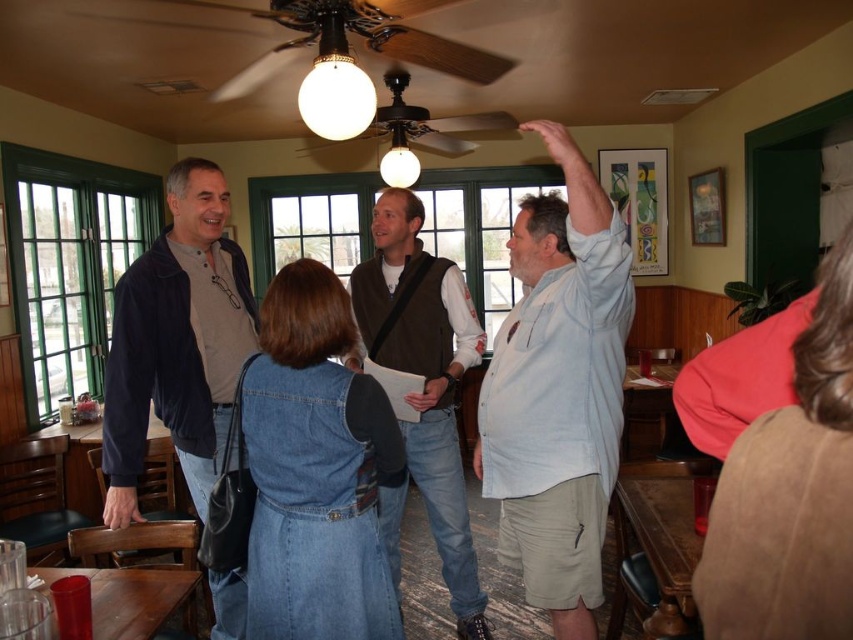
You are a delivery person who needs to place a small package between the light blue cotton shirt at upper right and the brown suede vest at center. Can the package, which is 20 inches long, fit in the space between them?

The distance between the light blue cotton shirt at upper right and the brown suede vest at center is 23.39 inches. Since the package is 20 inches long, it can fit in the space between them as there is enough room.

You are a photographer standing in the room. You need to take a photo of both the dark blue velvety jacket at left and the brown suede vest at center. Which one should you focus on first if you want to capture both clearly in the same frame?

The dark blue velvety jacket at left is above the brown suede vest at center, so you should focus on the brown suede vest at center first to ensure both are in focus since it is closer to the camera.